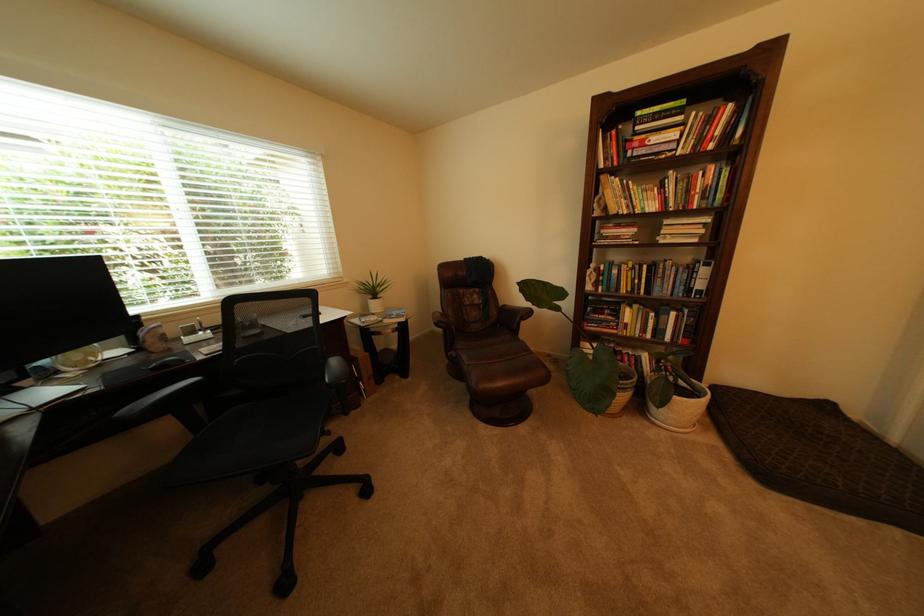
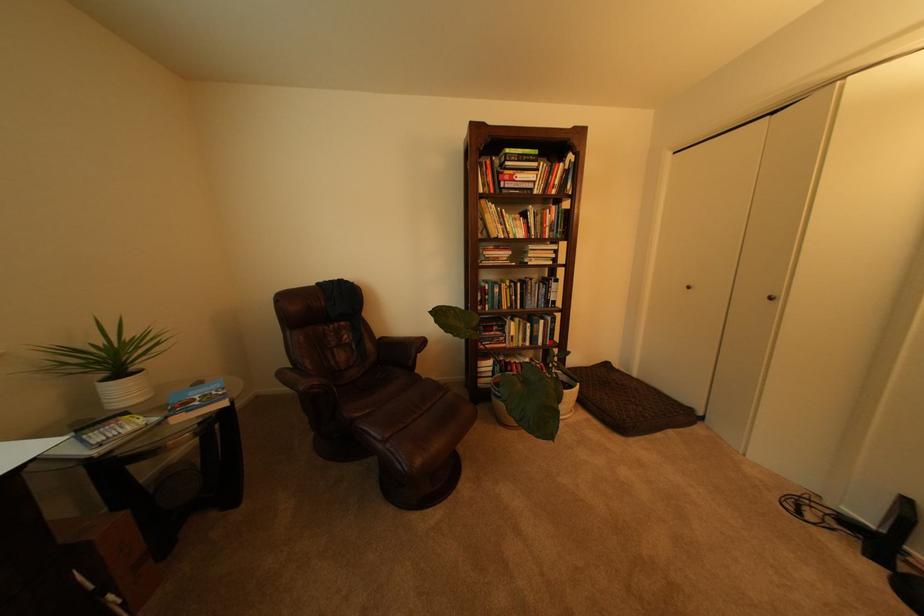
Where in the second image is the point corresponding to the point at 473,360 from the first image?

(383, 435)